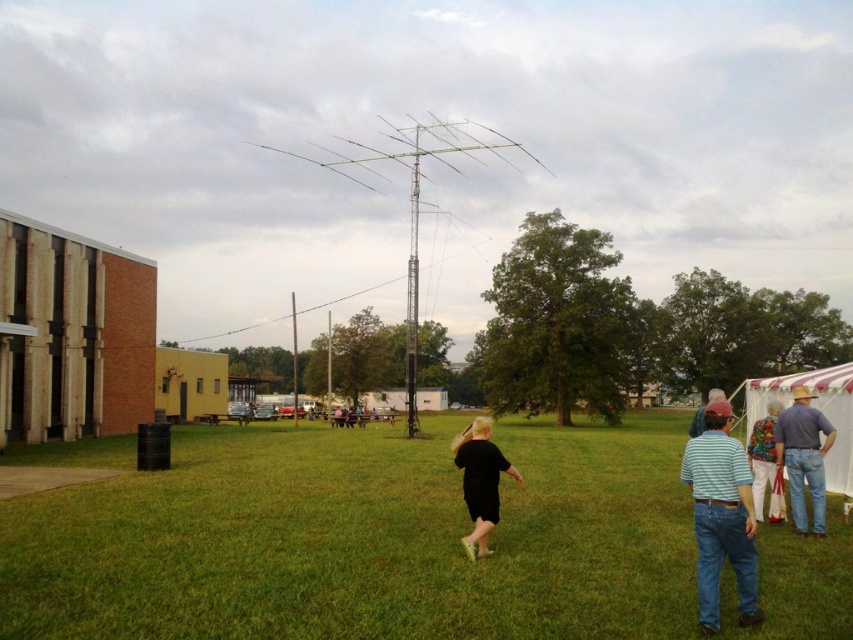
You are standing at the center of the grassy field. You need to locate the denim jeans at lower right. According to the coordinates provided, where exactly should you look to find them?

The denim jeans at lower right are located at coordinates point (804, 456).

You are a photographer setting up equipment for an event. You have a camera with a 1.2 meter wide lens. You need to place it between the white striped tent at lower right and the black matte shirt at center. Will the space between them be wide enough for your lens?

The white striped tent at lower right is wider than the black matte shirt at center. However, the description only provides information about their widths, not the distance between them. Without knowing the actual distance between the two objects, it is impossible to determine if the space will accommodate the 1.2 meter wide lens.

You are standing at the origin point of the image coordinate system. The denim jeans at lower right is located at point [804,456]. If you want to walk towards the denim jeans at lower right, which direction should you move in terms of x and y coordinates?

To reach the denim jeans at lower right located at point [804,456], you should move in the positive x and positive y direction since the coordinates are both greater than the origin point at 0,0.